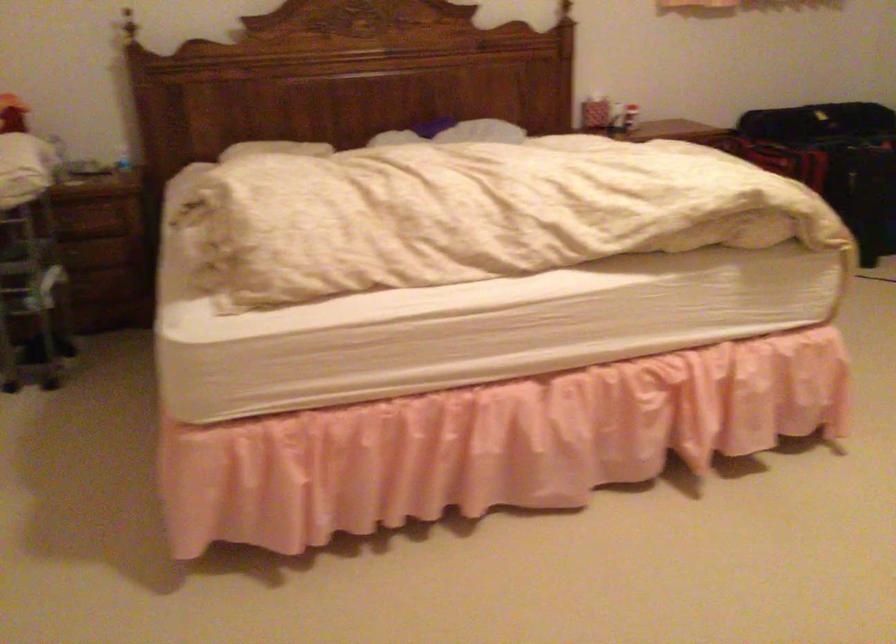
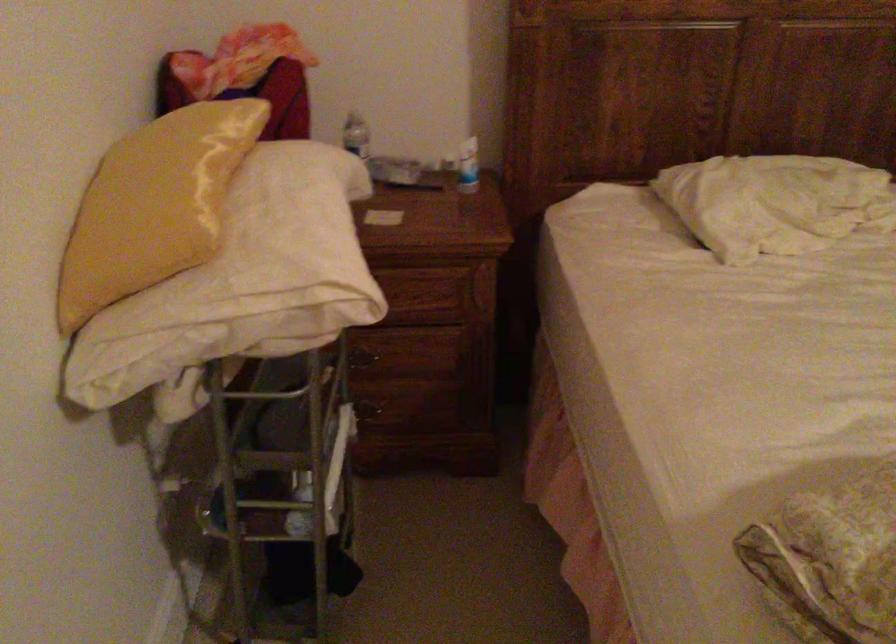
Locate, in the second image, the point that corresponds to the point at 102,248 in the first image.

(412, 365)